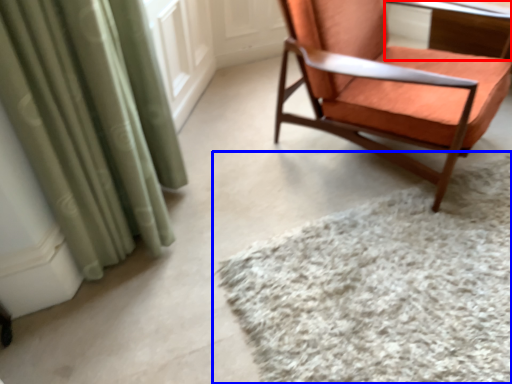
Question: Which object is further to the camera taking this photo, table (highlighted by a red box) or mat (highlighted by a blue box)?

Choices:
 (A) table
 (B) mat

Answer: (A)